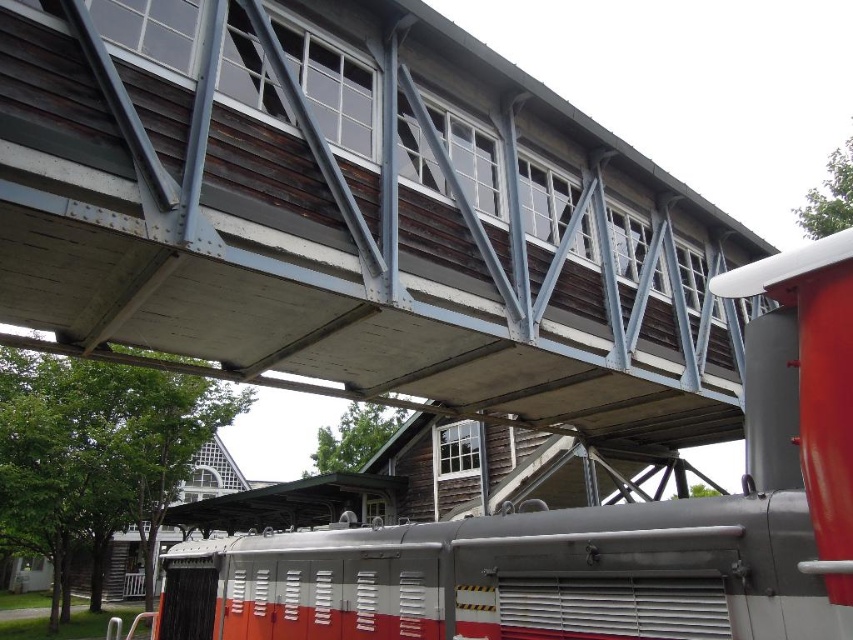
Question: Does wooden bridge at center appear on the left side of red and white metal train at center?

Choices:
 (A) yes
 (B) no

Answer: (A)

Question: Which point is farther to the camera?

Choices:
 (A) red and white metal train at center
 (B) wooden bridge at center

Answer: (B)

Question: Does wooden bridge at center appear on the left side of red and white metal train at center?

Choices:
 (A) no
 (B) yes

Answer: (B)

Question: Which object is closer to the camera taking this photo?

Choices:
 (A) wooden bridge at center
 (B) red and white metal train at center

Answer: (B)

Question: Is the position of wooden bridge at center less distant than that of red and white metal train at center?

Choices:
 (A) yes
 (B) no

Answer: (B)